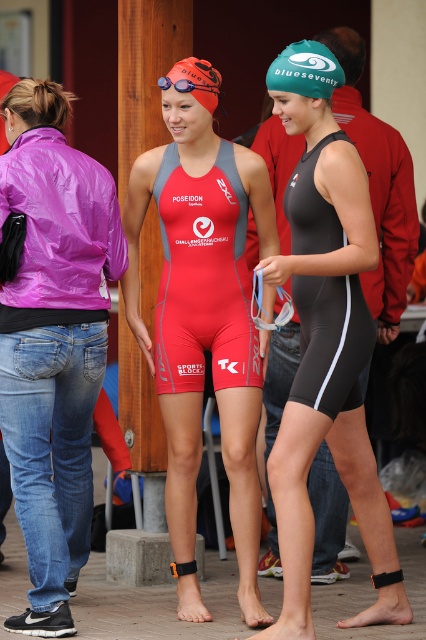
What is the position of the point with coordinates (x=203, y=326) in relation to the red swimsuit at center?

The point with coordinates (x=203, y=326) is located on the matte red swimsuit at center according to the provided spatial description.

You are a photographer at the event and need to place a camera at point (328, 364). What object will be directly under the camera?

The camera placed at point (328, 364) will be directly over the matte black swimsuit at center.

Consider the image. You are a photographer at the event and need to frame a shot that includes both the matte red wetsuit at center and the orange matte swim cap at upper center. Considering their sizes, which object should you adjust your focus on to ensure both fit in the frame?

The matte red wetsuit at center might be wider than the orange matte swim cap at upper center, so you should focus on the wider matte red wetsuit at center to ensure both fit in the frame.